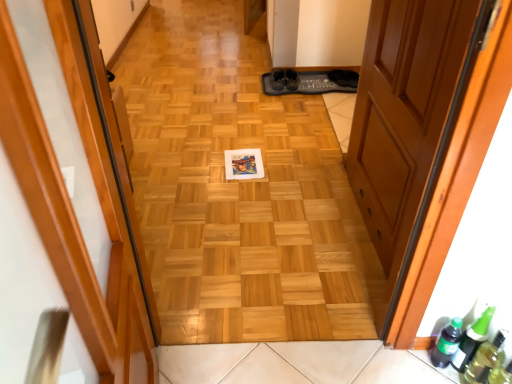
Question: Can you confirm if wooden door at center, the second door from the left, is taller than green glass beer bottle at lower right, acting as the second beer bottle starting from the left?

Choices:
 (A) no
 (B) yes

Answer: (B)

Question: Can you confirm if wooden door at center, which ranks as the first door in right-to-left order, is positioned to the left of green glass beer bottle at lower right, positioned as the first beer bottle in right-to-left order?

Choices:
 (A) no
 (B) yes

Answer: (B)

Question: Does wooden door at center, which ranks as the first door in right-to-left order, turn towards green glass beer bottle at lower right, acting as the second beer bottle starting from the left?

Choices:
 (A) yes
 (B) no

Answer: (B)

Question: Would you say wooden door at center, the second door from the left, is a long distance from green glass beer bottle at lower right, positioned as the first beer bottle in right-to-left order?

Choices:
 (A) no
 (B) yes

Answer: (A)

Question: Is wooden door at center, the second door from the left, wider than green glass beer bottle at lower right, acting as the second beer bottle starting from the left?

Choices:
 (A) no
 (B) yes

Answer: (A)

Question: Can you confirm if wooden door at center, the second door from the left, is shorter than green glass beer bottle at lower right, acting as the second beer bottle starting from the left?

Choices:
 (A) yes
 (B) no

Answer: (B)

Question: Can you confirm if wooden door at center, the second door from the left, is bigger than transparent plastic bottle at lower right?

Choices:
 (A) no
 (B) yes

Answer: (B)

Question: Is wooden door at center, the second door from the left, smaller than transparent plastic bottle at lower right?

Choices:
 (A) yes
 (B) no

Answer: (B)

Question: Can you confirm if wooden door at center, the second door from the left, is taller than transparent plastic bottle at lower right?

Choices:
 (A) no
 (B) yes

Answer: (B)

Question: Is wooden door at center, which ranks as the first door in right-to-left order, aimed at transparent plastic bottle at lower right?

Choices:
 (A) no
 (B) yes

Answer: (A)

Question: Is wooden door at center, which ranks as the first door in right-to-left order, outside of transparent plastic bottle at lower right?

Choices:
 (A) no
 (B) yes

Answer: (B)

Question: From the image's perspective, is wooden door at center, which ranks as the first door in right-to-left order, below transparent plastic bottle at lower right?

Choices:
 (A) yes
 (B) no

Answer: (B)

Question: Is green matte bottle at lower right, which is counted as the 1th beer bottle, starting from the left, wider than wooden floor at center?

Choices:
 (A) no
 (B) yes

Answer: (B)